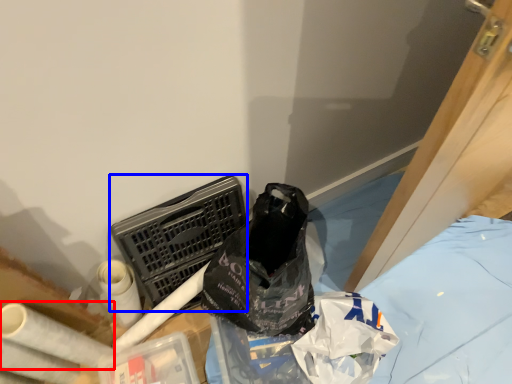
Question: Which object is closer to the camera taking this photo, toilet paper (highlighted by a red box) or laundry basket (highlighted by a blue box)?

Choices:
 (A) toilet paper
 (B) laundry basket

Answer: (A)